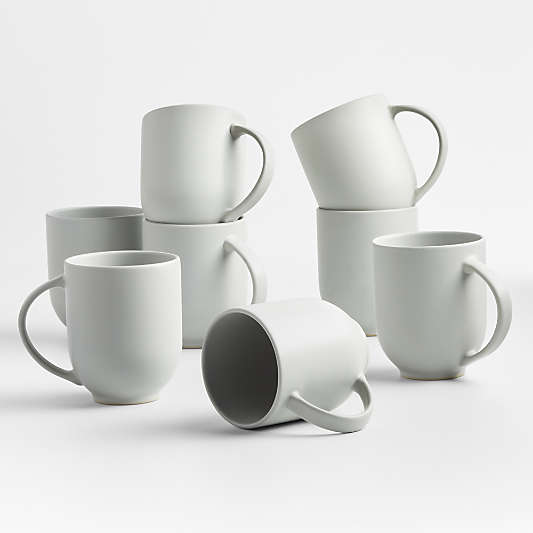
Where is `cup handles`? This screenshot has height=533, width=533. cup handles is located at coordinates (263, 174), (249, 265), (440, 161), (497, 300), (341, 416), (41, 356).